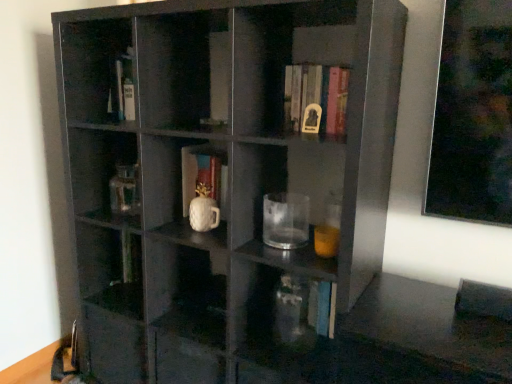
Question: From a real-world perspective, is transparent glass mug at center beneath transparent glass vase at lower center?

Choices:
 (A) no
 (B) yes

Answer: (A)

Question: Can you see transparent glass mug at center touching transparent glass vase at lower center?

Choices:
 (A) yes
 (B) no

Answer: (B)

Question: From the image's perspective, is transparent glass mug at center beneath transparent glass vase at lower center?

Choices:
 (A) no
 (B) yes

Answer: (A)

Question: Considering the relative positions of transparent glass mug at center and transparent glass vase at lower center in the image provided, is transparent glass mug at center to the right of transparent glass vase at lower center from the viewer's perspective?

Choices:
 (A) no
 (B) yes

Answer: (A)

Question: Is transparent glass vase at lower center surrounded by transparent glass mug at center?

Choices:
 (A) no
 (B) yes

Answer: (A)

Question: From a real-world perspective, is white glossy mug at center, which is the second book in front-to-back order, positioned above or below hardcover book at upper center, which is counted as the second book, starting from the left?

Choices:
 (A) below
 (B) above

Answer: (A)

Question: From their relative heights in the image, would you say white glossy mug at center, the second book in the top-to-bottom sequence, is taller or shorter than hardcover book at upper center, which appears as the 2th book when ordered from the bottom?

Choices:
 (A) short
 (B) tall

Answer: (B)

Question: Visually, is white glossy mug at center, the second book in the top-to-bottom sequence, positioned to the left or to the right of hardcover book at upper center, which is counted as the second book, starting from the left?

Choices:
 (A) left
 (B) right

Answer: (A)

Question: Considering the positions of white glossy mug at center, the first book when ordered from back to front, and hardcover book at upper center, which appears as the 2th book when ordered from the bottom, in the image, is white glossy mug at center, the first book when ordered from back to front, bigger or smaller than hardcover book at upper center, which appears as the 2th book when ordered from the bottom,?

Choices:
 (A) small
 (B) big

Answer: (A)

Question: Considering their positions, is hardcover book at upper center, which is counted as the second book, starting from the left, located in front of or behind matte black shelf at center?

Choices:
 (A) behind
 (B) front

Answer: (A)

Question: From the image's perspective, is hardcover book at upper center, which is the first book from right to left, located above or below matte black shelf at center?

Choices:
 (A) below
 (B) above

Answer: (B)

Question: Looking at their shapes, would you say hardcover book at upper center, which is counted as the second book, starting from the left, is wider or thinner than matte black shelf at center?

Choices:
 (A) wide
 (B) thin

Answer: (B)

Question: Is hardcover book at upper center, placed as the first book when sorted from front to back, taller or shorter than matte black shelf at center?

Choices:
 (A) short
 (B) tall

Answer: (A)

Question: Is point (279, 201) closer or farther from the camera than point (288, 122)?

Choices:
 (A) farther
 (B) closer

Answer: (B)

Question: Do you think transparent glass mug at center is within hardcover book at upper center, which is counted as the second book, starting from the left, or outside of it?

Choices:
 (A) outside
 (B) inside

Answer: (A)